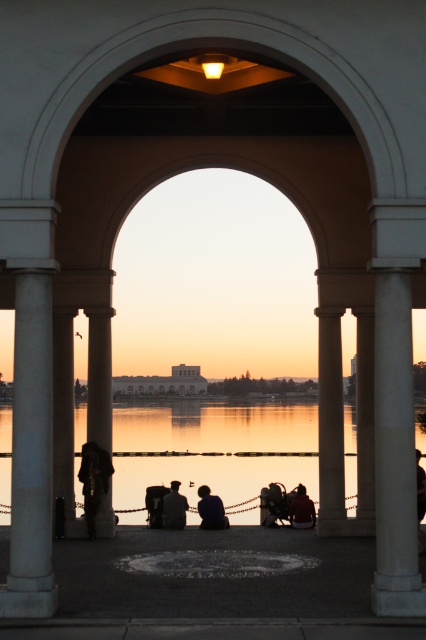
Question: Which is nearer to the silvery reflective water at center?

Choices:
 (A) silhouette human at center
 (B) white marble column at left
 (C) white marble column at right

Answer: (C)

Question: Among these points, which one is farthest from the camera?

Choices:
 (A) (236, 448)
 (B) (109, 384)
 (C) (304, 502)
 (D) (34, 326)

Answer: (A)

Question: Which of the following is the farthest from the observer?

Choices:
 (A) matte black jacket at center
 (B) white marble column at left
 (C) silhouette human at center

Answer: (A)

Question: Can you confirm if dark blue shirt at center is thinner than silhouette human at center?

Choices:
 (A) yes
 (B) no

Answer: (B)

Question: Observing the image, what is the correct spatial positioning of white marble column at left in reference to matte black jacket at lower center?

Choices:
 (A) left
 (B) right

Answer: (A)

Question: Is smooth white pillar at left to the right of dark gray fabric jacket at center from the viewer's perspective?

Choices:
 (A) yes
 (B) no

Answer: (B)